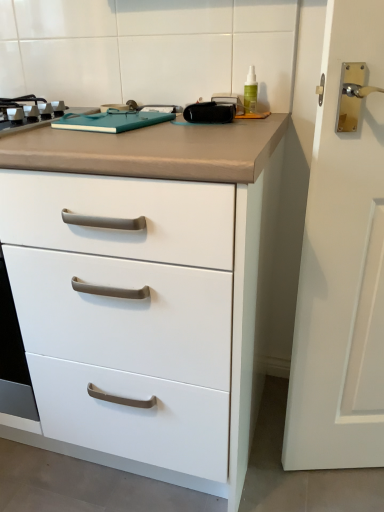
Question: From the image's perspective, is white matte chest of drawers at center located above or below metallic gray gas stove at upper left?

Choices:
 (A) below
 (B) above

Answer: (A)

Question: From their relative heights in the image, would you say white matte chest of drawers at center is taller or shorter than metallic gray gas stove at upper left?

Choices:
 (A) short
 (B) tall

Answer: (B)

Question: Which is nearer to the metallic gray gas stove at upper left?

Choices:
 (A) green translucent bottle at upper right
 (B) white matte chest of drawers at center

Answer: (B)

Question: Which is nearer to the white matte chest of drawers at center?

Choices:
 (A) green translucent bottle at upper right
 (B) metallic gray gas stove at upper left

Answer: (B)